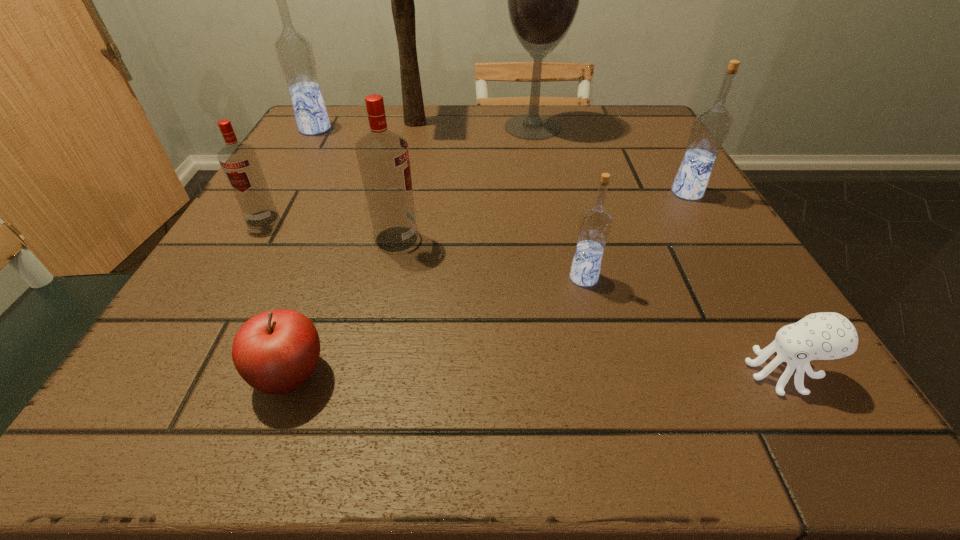
This screenshot has width=960, height=540. I want to click on the nearest vodka, so click(595, 224).

Where is `white octopus`? The image size is (960, 540). white octopus is located at coordinates (827, 335).

I want to click on red apple, so pos(275,352).

The image size is (960, 540). Identify the location of the third object from left to right. (275, 352).

I want to click on vacant area situated on the front of the mallet, so point(392,218).

Locate an element on the screen. vacant space situated 0.060m on the front of the alcohol is located at coordinates (538, 154).

Identify the location of vacant region located on the right of the third tallest object. The image size is (960, 540). (387, 129).

Find the location of a particular element. This screenshot has width=960, height=540. vacant space located on the front label of the bigger red vodka is located at coordinates (496, 239).

Where is `vacant space located on the back of the rightmost vodka`? vacant space located on the back of the rightmost vodka is located at coordinates (657, 143).

Identify the location of free spot located on the front label of the left red vodka. (x=228, y=276).